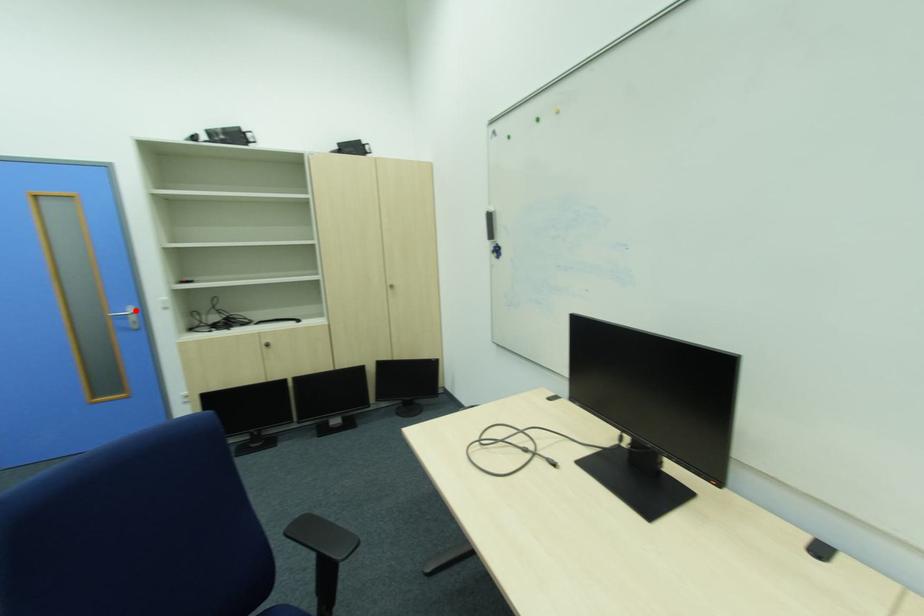
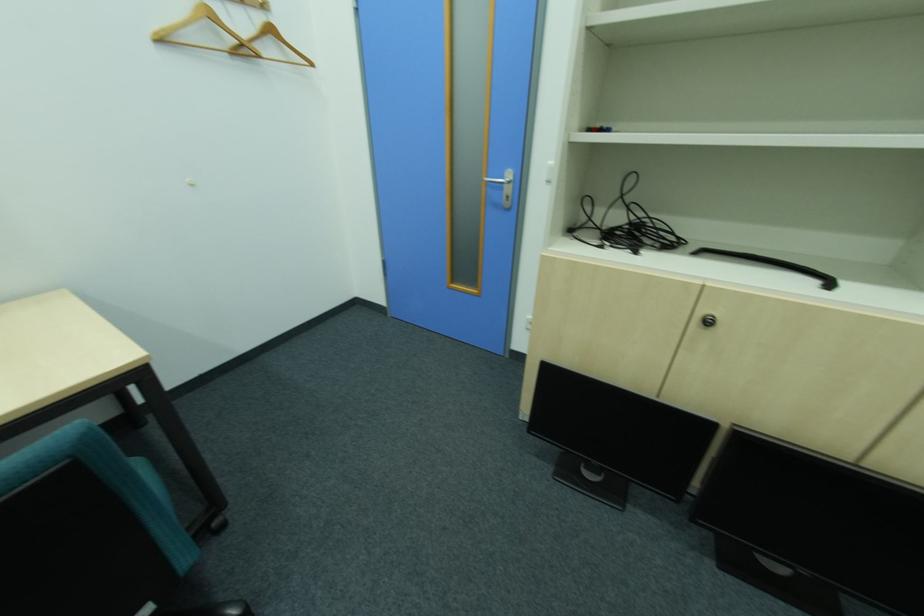
In the second image, find the point that corresponds to the highlighted location in the first image.

(513, 177)